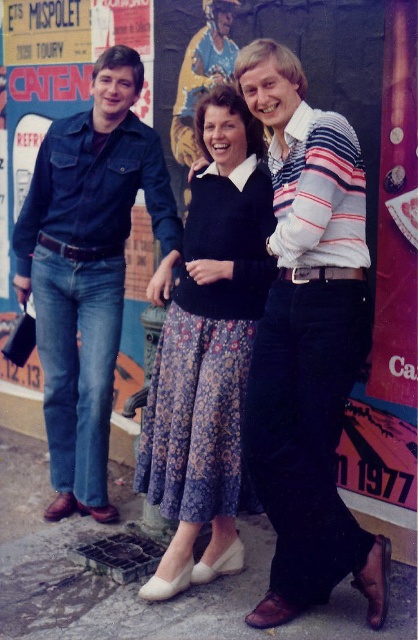
Question: Does denim jeans at left lie in front of floral cotton dress at center?

Choices:
 (A) yes
 (B) no

Answer: (B)

Question: Which object is the closest to the striped cotton shirt at center?

Choices:
 (A) floral cotton dress at center
 (B) denim jeans at left

Answer: (A)

Question: Which object is positioned farthest from the striped cotton shirt at center?

Choices:
 (A) denim jeans at left
 (B) floral cotton dress at center

Answer: (A)

Question: Can you confirm if denim jeans at left is smaller than floral cotton dress at center?

Choices:
 (A) yes
 (B) no

Answer: (B)

Question: Is denim jeans at left in front of floral cotton dress at center?

Choices:
 (A) yes
 (B) no

Answer: (B)

Question: Which object is positioned farthest from the striped cotton shirt at center?

Choices:
 (A) denim jeans at left
 (B) floral cotton dress at center

Answer: (A)